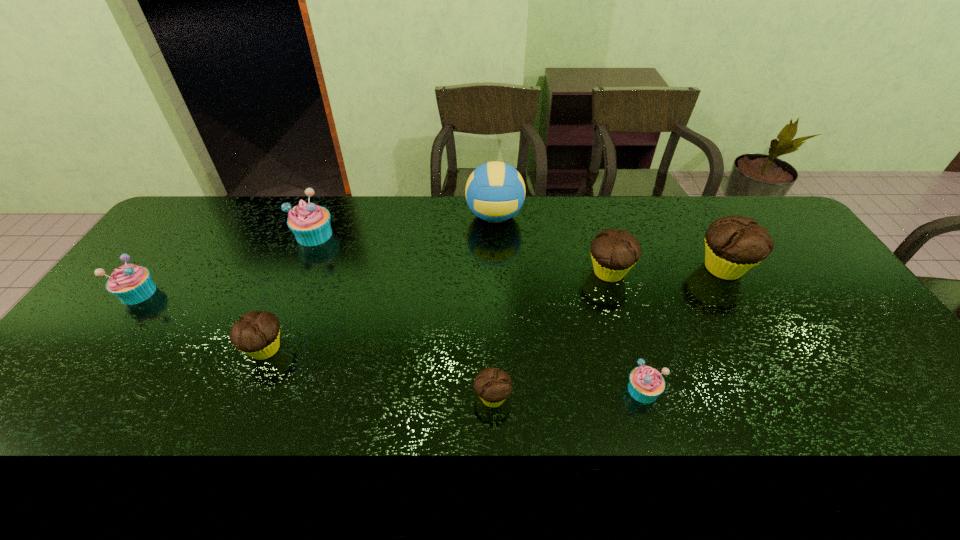
This screenshot has height=540, width=960. I want to click on blank region between the sixth farthest object and the second smallest blue muffin, so click(x=202, y=321).

Locate an element on the screen. This screenshot has height=540, width=960. vacant area between the farthest muffin and the leftmost chocolate muffin is located at coordinates (290, 292).

Locate an element on the screen. vacant region between the rightmost object and the leftmost blue muffin is located at coordinates (431, 281).

Identify the location of free space that is in between the leftmost object and the nearest chocolate muffin. The image size is (960, 540). (316, 345).

You are a GUI agent. You are given a task and a screenshot of the screen. Output one action in this format:
    pyautogui.click(x=<x>, y=<y>)
    Task: Click on the unoccupied area between the nearest chocolate muffin and the biggest blue muffin
    The height and width of the screenshot is (540, 960).
    Given the screenshot: What is the action you would take?
    pyautogui.click(x=403, y=316)

At what (x,y) coordinates should I click in order to perform the action: click on blank region between the third nearest object and the rightmost chocolate muffin. Please return your answer as a coordinate pair (x, y). The height and width of the screenshot is (540, 960). Looking at the image, I should click on (494, 309).

You are a GUI agent. You are given a task and a screenshot of the screen. Output one action in this format:
    pyautogui.click(x=<x>, y=<y>)
    Task: Click on the blank region between the leftmost object and the blue volleyball
    
    Given the screenshot: What is the action you would take?
    pyautogui.click(x=317, y=254)

Locate an element on the screen. This screenshot has height=540, width=960. free space that is in between the nearest chocolate muffin and the rightmost muffin is located at coordinates (609, 333).

Where is `free area in between the leftmost chocolate muffin and the third chocolate muffin from right to left`? The height and width of the screenshot is (540, 960). free area in between the leftmost chocolate muffin and the third chocolate muffin from right to left is located at coordinates (379, 374).

Locate an element on the screen. object identified as the fifth closest to the nearest blue muffin is located at coordinates (257, 333).